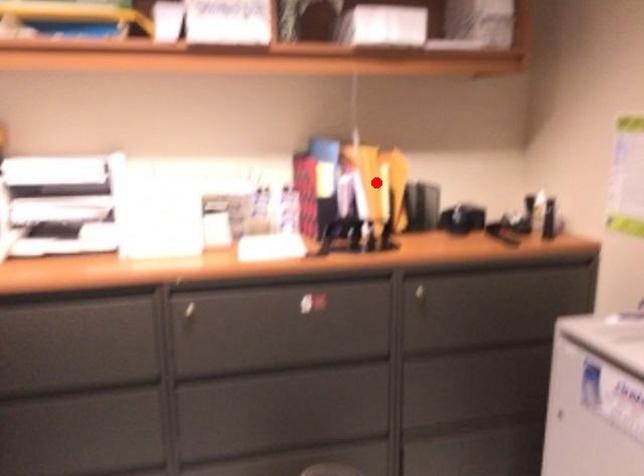
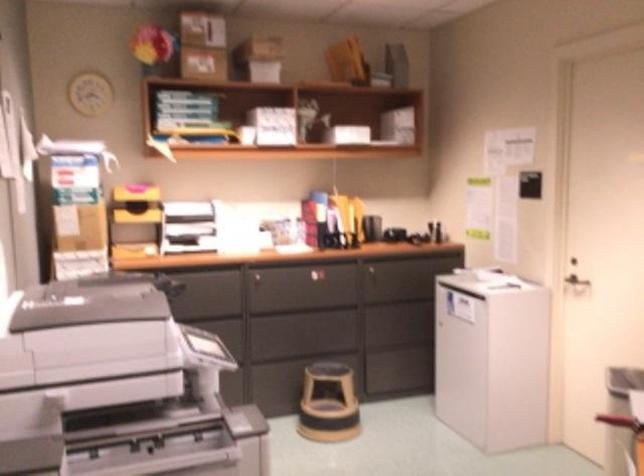
Question: I am providing you with two images of the same scene from different viewpoints. Given a red point in image1, look at the same physical point in image2. Is it:

Choices:
 (A) Closer to the viewpoint
 (B) Farther from the viewpoint

Answer: (B)